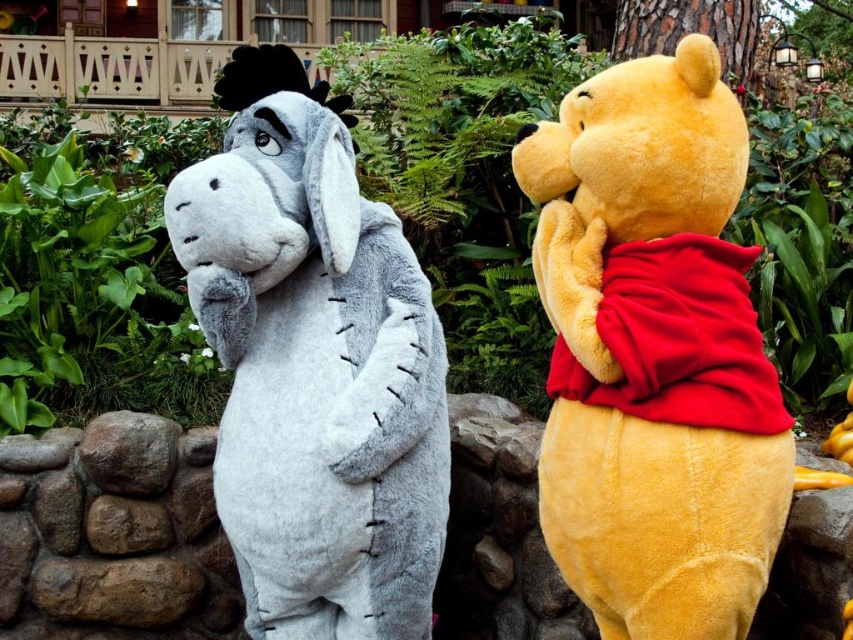
You are a visitor at the theme park and want to take a photo with both the soft yellow teddy bear at center and the fuzzy gray donkey at left. Since you can only focus on one character at a time, which one should you position closer to the camera to ensure both are in the frame?

You should position the fuzzy gray donkey at left closer to the camera because the soft yellow teddy bear at center is already to the right of the fuzzy gray donkey at left, meaning the donkey is farther away. By moving the donkey closer, both will be in the frame.